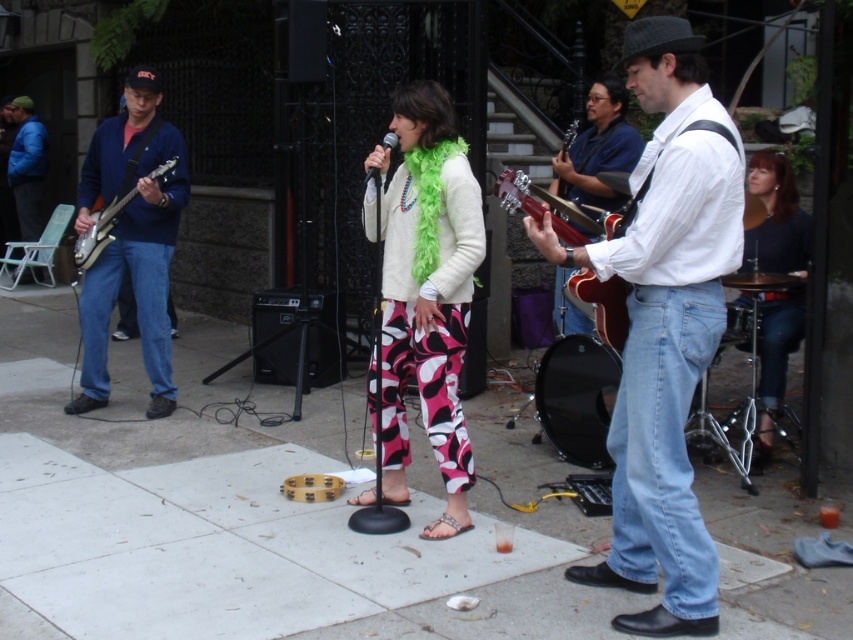
Question: Does blue denim jeans at left have a greater width compared to shiny brown guitar at center?

Choices:
 (A) yes
 (B) no

Answer: (A)

Question: Which point appears farthest from the camera in this image?

Choices:
 (A) (589, 134)
 (B) (657, 380)

Answer: (A)

Question: Which is nearer to the shiny brown guitar at center?

Choices:
 (A) white shirt at center
 (B) white concrete sidewalk at center

Answer: (A)

Question: Can you confirm if white shirt at center is positioned to the right of blue denim jacket at left?

Choices:
 (A) yes
 (B) no

Answer: (A)

Question: Estimate the real-world distances between objects in this image. Which object is closer to the shiny brown guitar at center?

Choices:
 (A) white shirt at center
 (B) dark blue shirt at right
 (C) shiny black electric guitar at left
 (D) white concrete sidewalk at center

Answer: (B)

Question: Can you confirm if white concrete sidewalk at center is thinner than blue denim jeans at left?

Choices:
 (A) yes
 (B) no

Answer: (B)